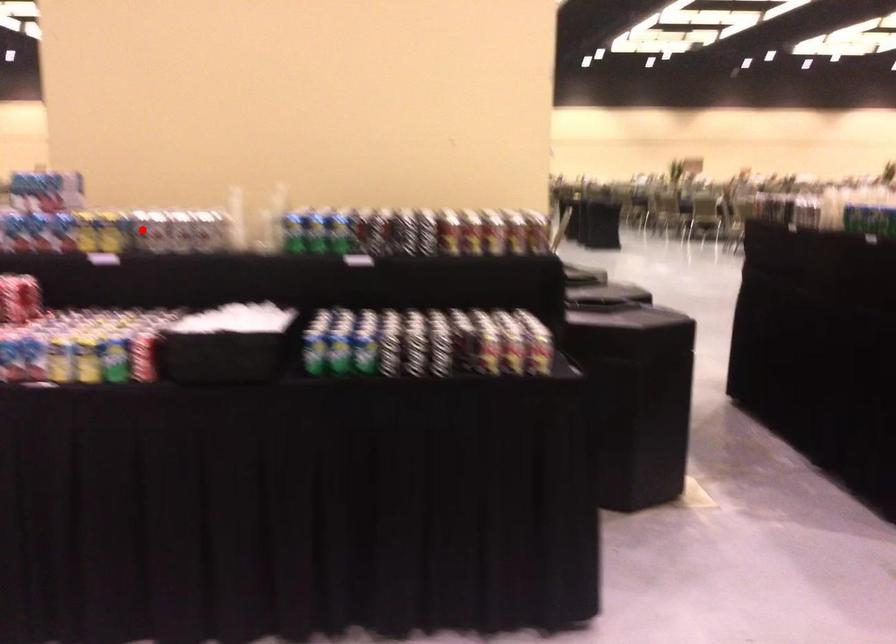
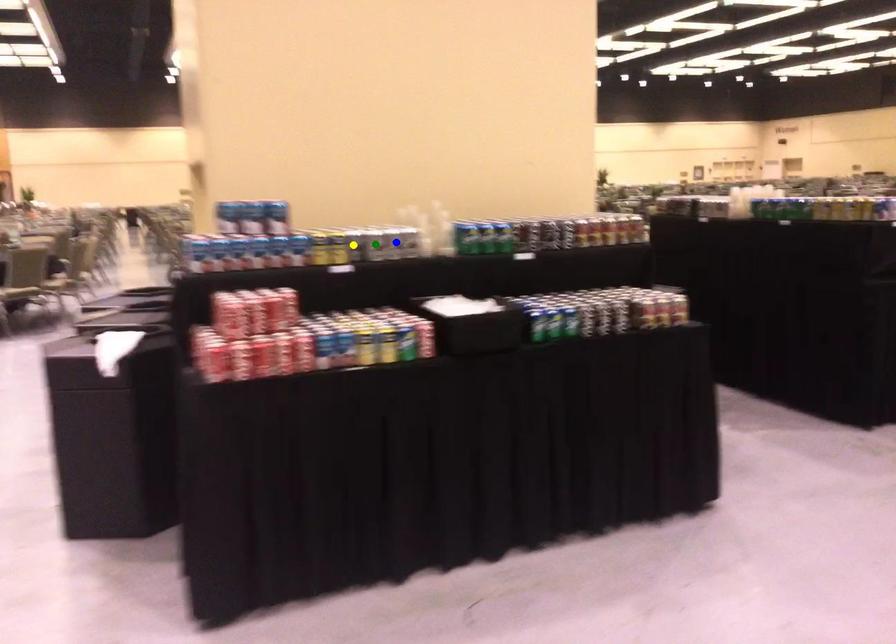
Question: I am providing you with two images of the same scene from different viewpoints. A red point is marked on the first image. You are given multiple points on the second image. In image 2, which mark is for the same physical point as the one in image 1?

Choices:
 (A) blue point
 (B) green point
 (C) yellow point

Answer: (C)